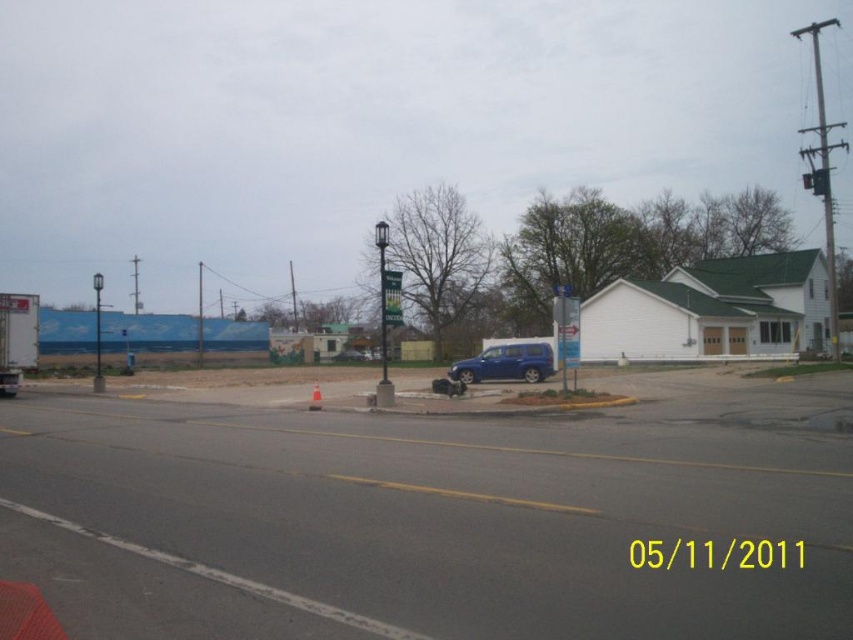
You are a delivery driver approaching the green fabric banner at center and the white plastic cone at center on the suburban street. Which object will you encounter first as you drive forward?

The green fabric banner at center is in front of the white plastic cone at center, so you will encounter the green fabric banner at center first.

You are standing on the suburban street and want to walk towards both the house with a green roof and the red mesh barrier. Which point, point [383,288] or point [318,387], is closer to you as you start walking?

Point [383,288] is closer to the viewer than point [318,387], so you will reach point [383,288] first.